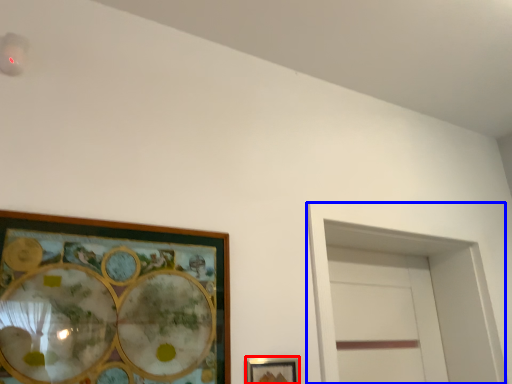
Question: Which object appears farthest to the camera in this image, picture frame (highlighted by a red box) or glass door (highlighted by a blue box)?

Choices:
 (A) picture frame
 (B) glass door

Answer: (B)